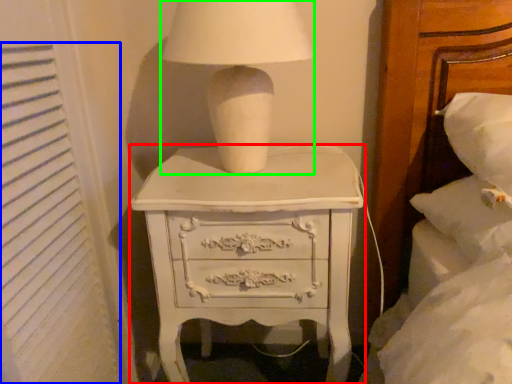
Question: Estimate the real-world distances between objects in this image. Which object is farther from chest of drawers (highlighted by a red box), curtain (highlighted by a blue box) or table lamp (highlighted by a green box)?

Choices:
 (A) curtain
 (B) table lamp

Answer: (A)